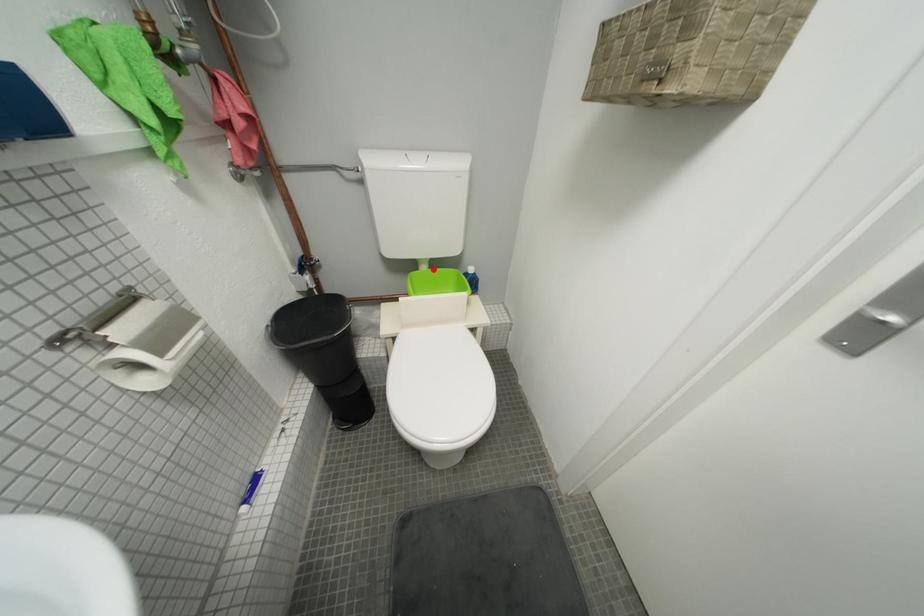
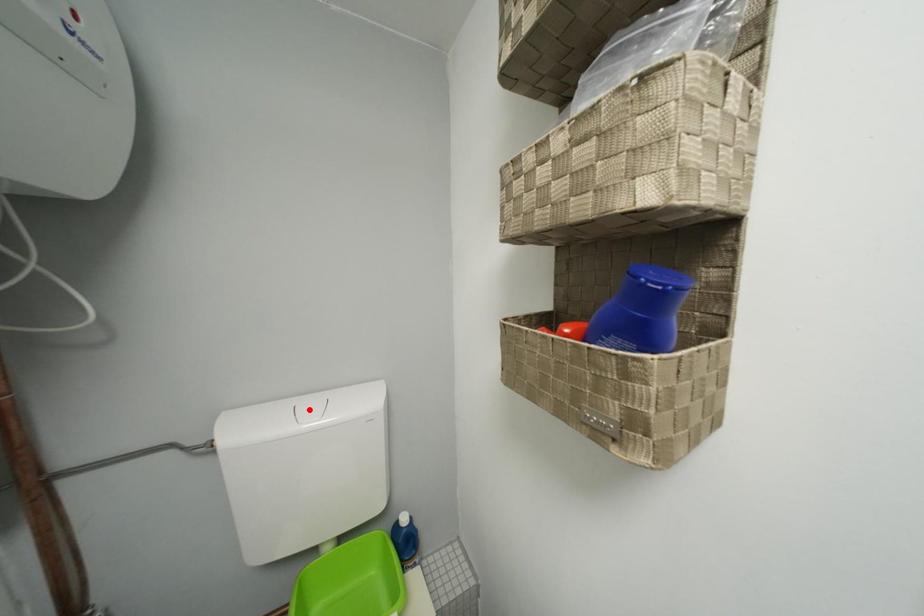
I am providing you with two images of the same scene from different viewpoints. A red point is marked on the first image and another point is marked on the second image. Do the highlighted points in image1 and image2 indicate the same real-world spot?

No